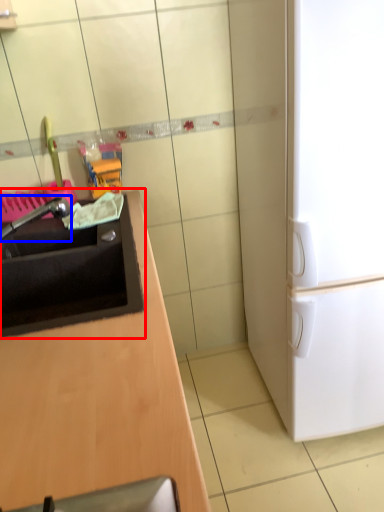
Question: Which of the following is the farthest to the observer, sink (highlighted by a red box) or faucet (highlighted by a blue box)?

Choices:
 (A) sink
 (B) faucet

Answer: (B)